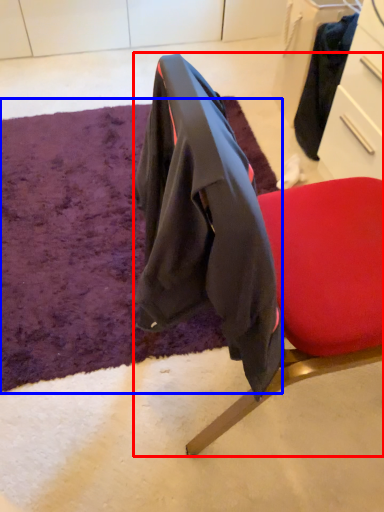
Question: Which object is closer to the camera taking this photo, chair (highlighted by a red box) or mat (highlighted by a blue box)?

Choices:
 (A) chair
 (B) mat

Answer: (A)